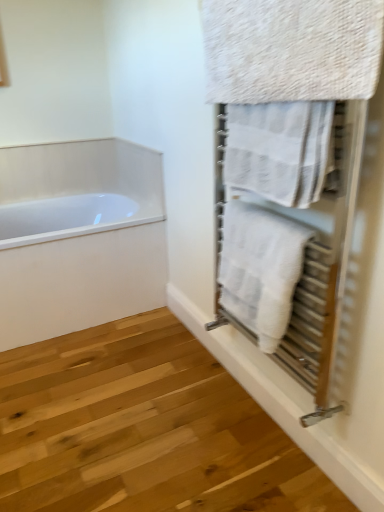
Looking at this image, in order to face white textured towel at upper right, acting as the second towel starting from the top, should I rotate leftwards or rightwards?

To align with it, rotate right about 11.608°.

The image size is (384, 512). Describe the element at coordinates (79, 237) in the screenshot. I see `white glossy bathtub at left` at that location.

Identify the location of white textured towel at upper right, acting as the second towel starting from the top. (280, 150).

How far apart are white glossy bathtub at left and white textured towel at upper right, arranged as the 2th towel when ordered from the bottom?

A distance of 1.19 meters exists between white glossy bathtub at left and white textured towel at upper right, arranged as the 2th towel when ordered from the bottom.

Considering the positions of objects white glossy bathtub at left and white textured towel at upper right, arranged as the 2th towel when ordered from the bottom, in the image provided, who is more to the right, white glossy bathtub at left or white textured towel at upper right, arranged as the 2th towel when ordered from the bottom,?

white textured towel at upper right, arranged as the 2th towel when ordered from the bottom, is more to the right.

Which of these two, white glossy bathtub at left or white textured towel at upper right, acting as the second towel starting from the top, is thinner?

white textured towel at upper right, acting as the second towel starting from the top, is thinner.

The height and width of the screenshot is (512, 384). What are the coordinates of `the 1st towel above the white glossy bathtub at left (from a real-world perspective)` in the screenshot? It's located at (260, 269).

Can we say white textured towel at right, positioned as the third towel in top-to-bottom order, lies outside white glossy bathtub at left?

Yes, white textured towel at right, positioned as the third towel in top-to-bottom order, is located beyond the bounds of white glossy bathtub at left.

Can you confirm if white textured towel at right, the first towel positioned from the bottom, is thinner than white glossy bathtub at left?

Indeed, white textured towel at right, the first towel positioned from the bottom, has a lesser width compared to white glossy bathtub at left.

Visually, is white textured towel at right, the first towel positioned from the bottom, positioned to the left or to the right of white glossy bathtub at left?

In the image, white textured towel at right, the first towel positioned from the bottom, appears on the right side of white glossy bathtub at left.

Considering the relative sizes of white glossy bathtub at left and textured beige towel at upper right, arranged as the 1th towel when viewed from the top, in the image provided, is white glossy bathtub at left taller than textured beige towel at upper right, arranged as the 1th towel when viewed from the top,?

Yes, white glossy bathtub at left is taller than textured beige towel at upper right, arranged as the 1th towel when viewed from the top.

From a real-world perspective, is white glossy bathtub at left under textured beige towel at upper right, arranged as the 1th towel when viewed from the top?

Correct, in the physical world, white glossy bathtub at left is lower than textured beige towel at upper right, arranged as the 1th towel when viewed from the top.

In terms of width, does white glossy bathtub at left look wider or thinner when compared to textured beige towel at upper right, arranged as the 1th towel when viewed from the top?

white glossy bathtub at left is wider than textured beige towel at upper right, arranged as the 1th towel when viewed from the top.

Find the location of a particular element. bathtub below the textured beige towel at upper right, arranged as the 1th towel when viewed from the top (from a real-world perspective) is located at coordinates pyautogui.click(x=79, y=237).

From the image's perspective, is white glossy bathtub at left on top of white textured towel at right, the first towel positioned from the bottom?

Yes, from the image's perspective, white glossy bathtub at left is above white textured towel at right, the first towel positioned from the bottom.

Considering the positions of objects white glossy bathtub at left and white textured towel at right, the first towel positioned from the bottom, in the image provided, who is more to the right, white glossy bathtub at left or white textured towel at right, the first towel positioned from the bottom,?

white textured towel at right, the first towel positioned from the bottom, is more to the right.

From the picture: Between white glossy bathtub at left and white textured towel at right, positioned as the third towel in top-to-bottom order, which one has less height?

Standing shorter between the two is white textured towel at right, positioned as the third towel in top-to-bottom order.

Is white textured towel at upper right, acting as the second towel starting from the top, oriented towards white glossy bathtub at left?

No, white textured towel at upper right, acting as the second towel starting from the top, is not aimed at white glossy bathtub at left.

Which object is further away from the camera taking this photo, white textured towel at upper right, arranged as the 2th towel when ordered from the bottom, or white glossy bathtub at left?

white glossy bathtub at left is further from the camera.

Is point (321, 111) closer to viewer compared to point (0, 170)?

Yes, it is.

I want to click on towel located in front of the white textured towel at upper right, acting as the second towel starting from the top, so click(291, 49).

Between textured beige towel at upper right, arranged as the 1th towel when viewed from the top, and white textured towel at upper right, arranged as the 2th towel when ordered from the bottom, which one has larger size?

With larger size is textured beige towel at upper right, arranged as the 1th towel when viewed from the top.

Which is more to the left, textured beige towel at upper right, the third towel from the bottom, or white textured towel at upper right, acting as the second towel starting from the top?

textured beige towel at upper right, the third towel from the bottom.

Find the location of a particular element. This screenshot has width=384, height=512. towel that is the 2nd one above the white textured towel at right, the first towel positioned from the bottom (from a real-world perspective) is located at coordinates (291, 49).

Which of these two, textured beige towel at upper right, the third towel from the bottom, or white textured towel at right, the first towel positioned from the bottom, stands shorter?

textured beige towel at upper right, the third towel from the bottom, is shorter.

Is textured beige towel at upper right, the third towel from the bottom, beside white textured towel at right, the first towel positioned from the bottom?

textured beige towel at upper right, the third towel from the bottom, is not next to white textured towel at right, the first towel positioned from the bottom, and they're not touching.

Locate an element on the screen. This screenshot has height=512, width=384. bathtub that appears behind the white textured towel at upper right, arranged as the 2th towel when ordered from the bottom is located at coordinates (79, 237).

Locate an element on the screen. bathtub that appears on the left of white textured towel at right, the first towel positioned from the bottom is located at coordinates (79, 237).

When comparing their distances from white glossy bathtub at left, does white textured towel at upper right, arranged as the 2th towel when ordered from the bottom, or white textured towel at right, positioned as the third towel in top-to-bottom order, seem further?

white textured towel at upper right, arranged as the 2th towel when ordered from the bottom, is further to white glossy bathtub at left.

When comparing their distances from white glossy bathtub at left, does white textured towel at upper right, arranged as the 2th towel when ordered from the bottom, or textured beige towel at upper right, arranged as the 1th towel when viewed from the top, seem closer?

white textured towel at upper right, arranged as the 2th towel when ordered from the bottom, lies closer to white glossy bathtub at left than the other object.

Considering their positions, is white textured towel at upper right, acting as the second towel starting from the top, positioned closer to white textured towel at right, the first towel positioned from the bottom, than textured beige towel at upper right, the third towel from the bottom?

Based on the image, white textured towel at upper right, acting as the second towel starting from the top, appears to be nearer to white textured towel at right, the first towel positioned from the bottom.

Estimate the real-world distances between objects in this image. Which object is closer to white glossy bathtub at left, white textured towel at right, the first towel positioned from the bottom, or white textured towel at upper right, arranged as the 2th towel when ordered from the bottom?

The object closer to white glossy bathtub at left is white textured towel at right, the first towel positioned from the bottom.

From the image, which object appears to be nearer to textured beige towel at upper right, arranged as the 1th towel when viewed from the top, white glossy bathtub at left or white textured towel at right, the first towel positioned from the bottom?

Among the two, white textured towel at right, the first towel positioned from the bottom, is located nearer to textured beige towel at upper right, arranged as the 1th towel when viewed from the top.

Estimate the real-world distances between objects in this image. Which object is further from white glossy bathtub at left, white textured towel at right, the first towel positioned from the bottom, or textured beige towel at upper right, arranged as the 1th towel when viewed from the top?

The object further to white glossy bathtub at left is textured beige towel at upper right, arranged as the 1th towel when viewed from the top.

Which object lies nearer to the anchor point textured beige towel at upper right, arranged as the 1th towel when viewed from the top, white textured towel at right, the first towel positioned from the bottom, or white textured towel at upper right, arranged as the 2th towel when ordered from the bottom?

white textured towel at upper right, arranged as the 2th towel when ordered from the bottom.

Which object lies further to the anchor point white textured towel at upper right, acting as the second towel starting from the top, white glossy bathtub at left or textured beige towel at upper right, the third towel from the bottom?

white glossy bathtub at left is further to white textured towel at upper right, acting as the second towel starting from the top.

I want to click on towel between textured beige towel at upper right, arranged as the 1th towel when viewed from the top, and white textured towel at right, the first towel positioned from the bottom, vertically, so click(x=280, y=150).